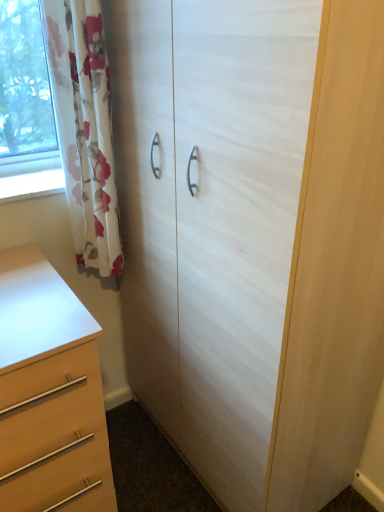
Question: Considering the relative sizes of floral fabric curtain at left and white wood cupboard at center in the image provided, is floral fabric curtain at left shorter than white wood cupboard at center?

Choices:
 (A) no
 (B) yes

Answer: (B)

Question: Can you confirm if floral fabric curtain at left is thinner than white wood cupboard at center?

Choices:
 (A) no
 (B) yes

Answer: (B)

Question: Is floral fabric curtain at left not inside white wood cupboard at center?

Choices:
 (A) yes
 (B) no

Answer: (A)

Question: From a real-world perspective, is floral fabric curtain at left positioned over white wood cupboard at center based on gravity?

Choices:
 (A) yes
 (B) no

Answer: (A)

Question: Is the position of floral fabric curtain at left more distant than that of white wood cupboard at center?

Choices:
 (A) yes
 (B) no

Answer: (A)

Question: In terms of size, does floral fabric curtain at left appear bigger or smaller than matte wood chest of drawers at lower left?

Choices:
 (A) small
 (B) big

Answer: (A)

Question: From the image's perspective, relative to matte wood chest of drawers at lower left, is floral fabric curtain at left above or below?

Choices:
 (A) above
 (B) below

Answer: (A)

Question: In terms of height, does floral fabric curtain at left look taller or shorter compared to matte wood chest of drawers at lower left?

Choices:
 (A) tall
 (B) short

Answer: (A)

Question: From a real-world perspective, is floral fabric curtain at left positioned above or below matte wood chest of drawers at lower left?

Choices:
 (A) below
 (B) above

Answer: (B)

Question: Based on their positions, is white wood cupboard at center located to the left or right of matte wood chest of drawers at lower left?

Choices:
 (A) left
 (B) right

Answer: (B)

Question: Considering the positions of point (140, 349) and point (91, 373), is point (140, 349) closer or farther from the camera than point (91, 373)?

Choices:
 (A) closer
 (B) farther

Answer: (B)

Question: Looking at the image, does white wood cupboard at center seem bigger or smaller compared to matte wood chest of drawers at lower left?

Choices:
 (A) big
 (B) small

Answer: (A)

Question: From a real-world perspective, relative to matte wood chest of drawers at lower left, is white wood cupboard at center vertically above or below?

Choices:
 (A) above
 (B) below

Answer: (A)

Question: Looking at the image, does white wood cupboard at center seem bigger or smaller compared to floral fabric curtain at left?

Choices:
 (A) small
 (B) big

Answer: (B)

Question: Is white wood cupboard at center taller or shorter than floral fabric curtain at left?

Choices:
 (A) short
 (B) tall

Answer: (B)